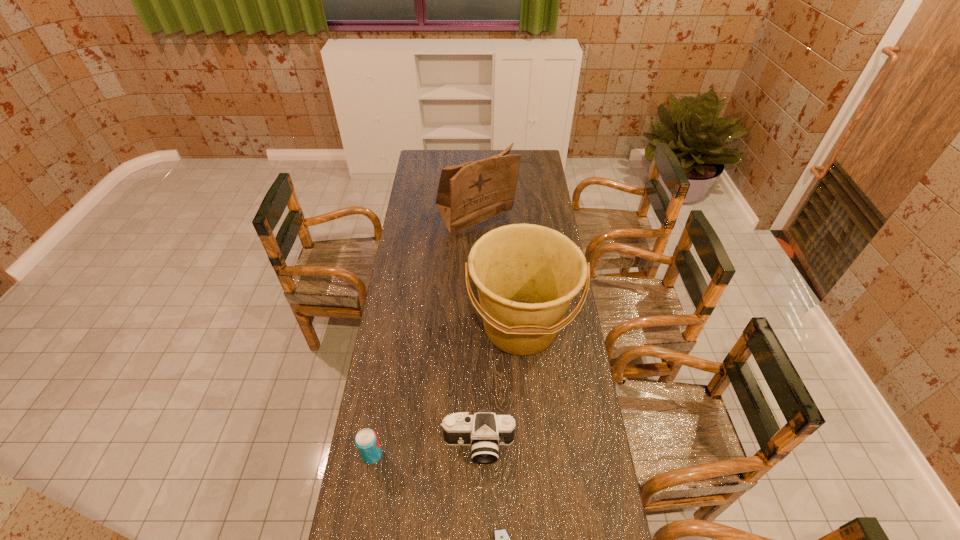
The width and height of the screenshot is (960, 540). Identify the location of empty space that is in between the camera and the farthest object. (477, 334).

Locate an element on the screen. free area in between the leftmost object and the fourth shortest object is located at coordinates (446, 391).

Where is `unoccupied area between the leftmost object and the farthest object`? The height and width of the screenshot is (540, 960). unoccupied area between the leftmost object and the farthest object is located at coordinates (424, 339).

At what (x,y) coordinates should I click in order to perform the action: click on vacant space that is in between the tallest object and the camera. Please return your answer as a coordinate pair (x, y). Looking at the image, I should click on (477, 334).

Choose which object is the fourth nearest neighbor to the leftmost object. Please provide its 2D coordinates. Your answer should be formatted as a tuple, i.e. [(x, y)], where the tuple contains the x and y coordinates of a point satisfying the conditions above.

[(468, 194)]

Identify which object is located as the third nearest to the grocery bag. Please provide its 2D coordinates. Your answer should be formatted as a tuple, i.e. [(x, y)], where the tuple contains the x and y coordinates of a point satisfying the conditions above.

[(366, 440)]

At what (x,y) coordinates should I click in order to perform the action: click on free space that satisfies the following two spatial constraints: 1. on the back side of the leftmost object; 2. on the right side of the tallest object. Please return your answer as a coordinate pair (x, y). The image size is (960, 540). Looking at the image, I should click on (412, 222).

I want to click on free space that satisfies the following two spatial constraints: 1. on the back side of the grocery bag; 2. on the left side of the soda can, so click(x=412, y=222).

The width and height of the screenshot is (960, 540). I want to click on blank space that satisfies the following two spatial constraints: 1. on the front side of the camera; 2. on the left side of the farthest object, so click(x=472, y=446).